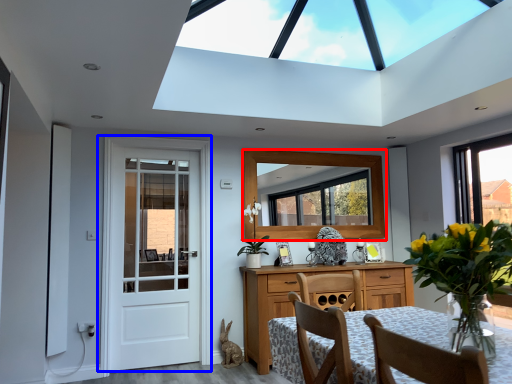
Question: Which of the following is the farthest to the observer, window (highlighted by a red box) or door (highlighted by a blue box)?

Choices:
 (A) window
 (B) door

Answer: (A)